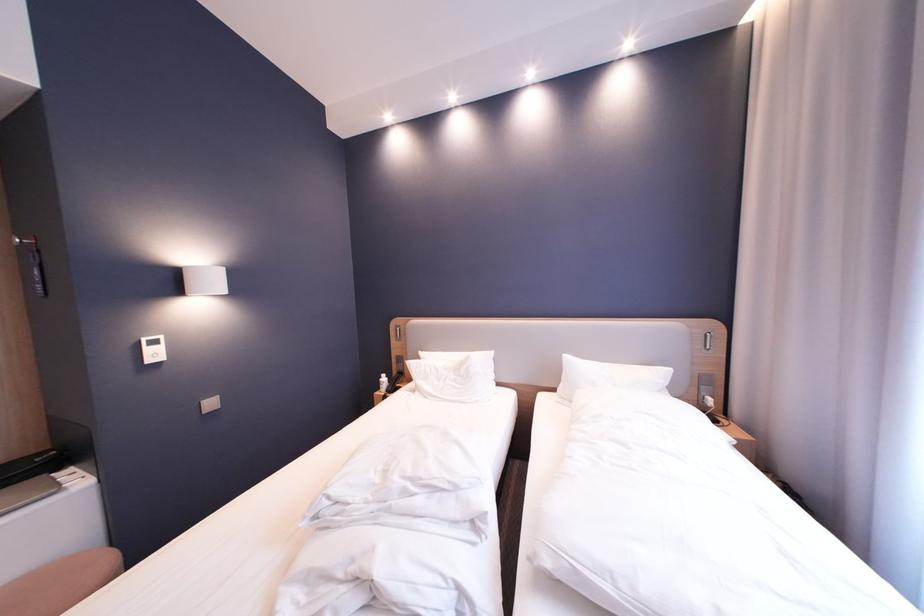
Image resolution: width=924 pixels, height=616 pixels. Describe the element at coordinates (31, 466) in the screenshot. I see `a black telephone receiver` at that location.